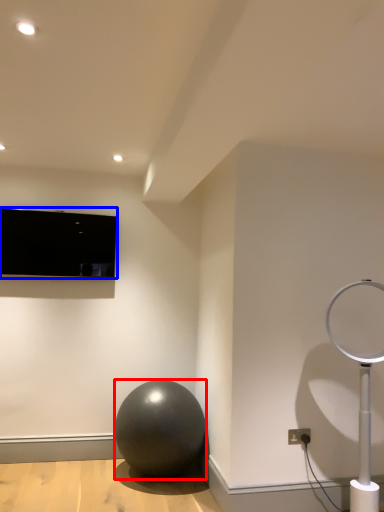
Question: Which of the following is the farthest to the observer, ball (highlighted by a red box) or television (highlighted by a blue box)?

Choices:
 (A) ball
 (B) television

Answer: (B)